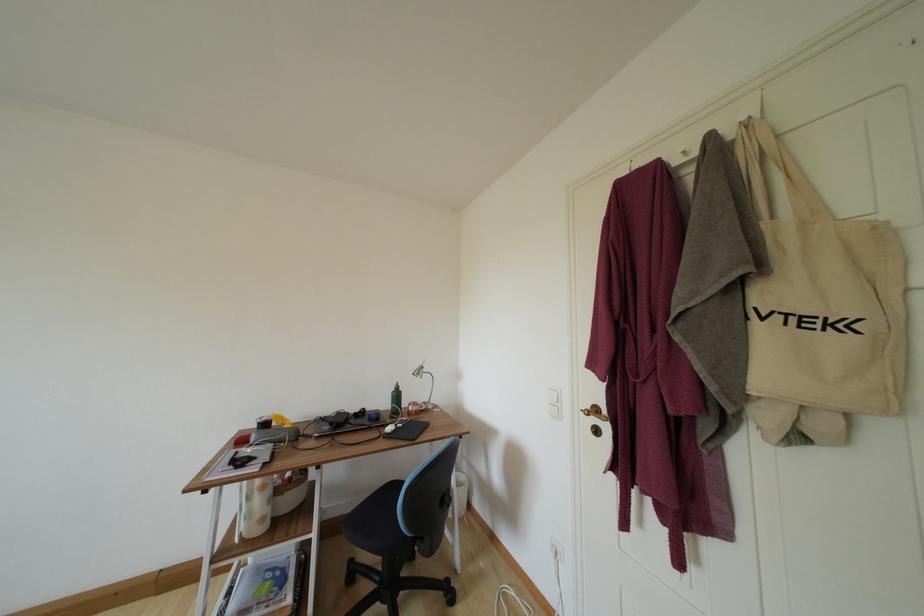
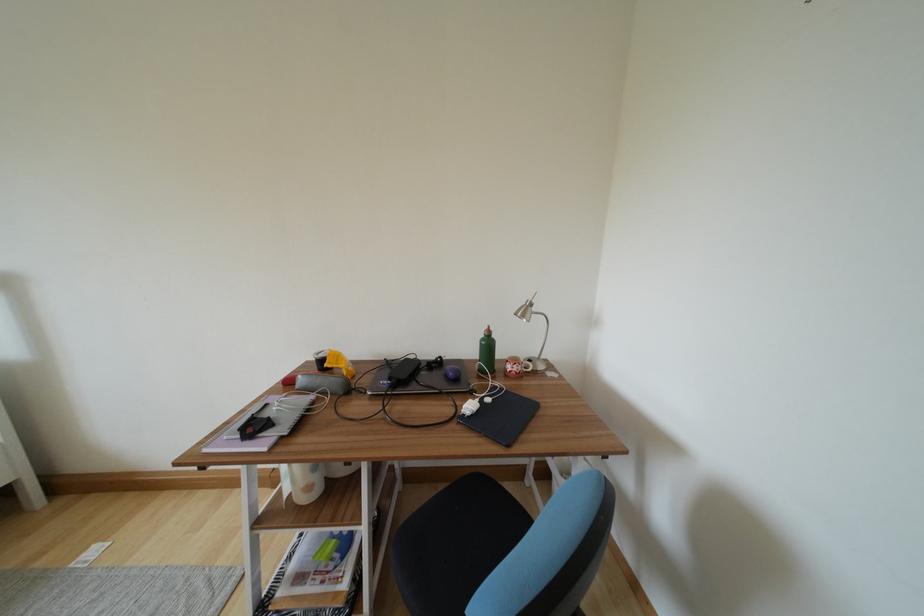
Locate, in the second image, the point that corresponds to pixel 416 411 in the first image.

(514, 371)